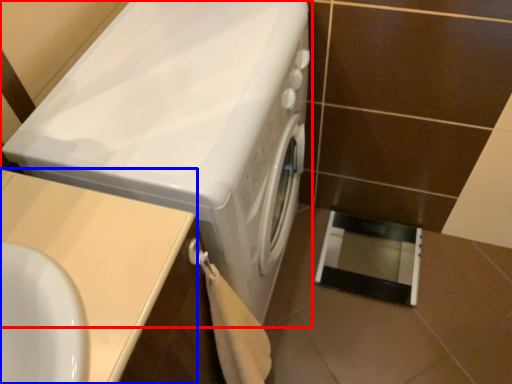
Question: Which of the following is the closest to the observer, washing machine (highlighted by a red box) or counter top (highlighted by a blue box)?

Choices:
 (A) washing machine
 (B) counter top

Answer: (B)